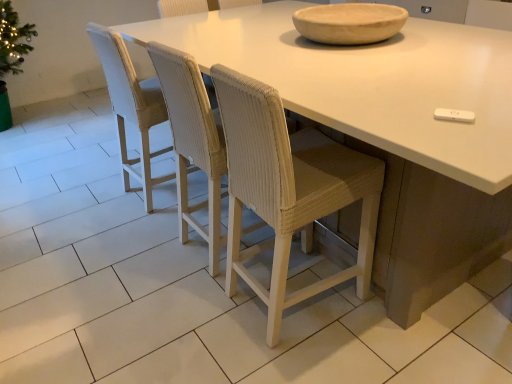
Question: Does woven white chair at left, which is the 1th chair in left-to-right order, appear on the right side of white woven chair at center, the fourth chair from the left?

Choices:
 (A) yes
 (B) no

Answer: (B)

Question: Considering the relative sizes of woven white chair at left, the fourth chair from the right, and white woven chair at center, which appears as the 1th chair when viewed from the right, in the image provided, is woven white chair at left, the fourth chair from the right, smaller than white woven chair at center, which appears as the 1th chair when viewed from the right,?

Choices:
 (A) no
 (B) yes

Answer: (A)

Question: From a real-world perspective, does woven white chair at left, the fourth chair from the right, sit lower than white woven chair at center, the fourth chair from the left?

Choices:
 (A) no
 (B) yes

Answer: (B)

Question: Is woven white chair at left, the fourth chair from the right, placed right next to white woven chair at center, which appears as the 1th chair when viewed from the right?

Choices:
 (A) no
 (B) yes

Answer: (A)

Question: Can you confirm if woven white chair at left, the fourth chair from the right, is positioned to the left of white woven chair at center, the fourth chair from the left?

Choices:
 (A) yes
 (B) no

Answer: (A)

Question: Is white matte table at center bigger or smaller than woven white chair at center, which ranks as the third chair in left-to-right order?

Choices:
 (A) big
 (B) small

Answer: (A)

Question: Looking at their shapes, would you say white matte table at center is wider or thinner than woven white chair at center, which ranks as the third chair in left-to-right order?

Choices:
 (A) wide
 (B) thin

Answer: (A)

Question: In the image, is white matte table at center positioned in front of or behind woven white chair at center, marked as the second chair in a right-to-left arrangement?

Choices:
 (A) front
 (B) behind

Answer: (A)

Question: Considering the relative positions of white matte table at center and woven white chair at center, which ranks as the third chair in left-to-right order, in the image provided, is white matte table at center to the left or to the right of woven white chair at center, which ranks as the third chair in left-to-right order,?

Choices:
 (A) right
 (B) left

Answer: (A)

Question: From the image's perspective, relative to woven white chair at center, the third chair from the right, is white matte table at center above or below?

Choices:
 (A) below
 (B) above

Answer: (B)

Question: Choose the correct answer: Is white matte table at center inside woven white chair at center, which is the 2th chair in left-to-right order, or outside it?

Choices:
 (A) inside
 (B) outside

Answer: (B)

Question: Considering the positions of white matte table at center and woven white chair at center, the third chair from the right, in the image, is white matte table at center bigger or smaller than woven white chair at center, the third chair from the right,?

Choices:
 (A) big
 (B) small

Answer: (A)

Question: In terms of height, does white matte table at center look taller or shorter compared to woven white chair at center, which is the 2th chair in left-to-right order?

Choices:
 (A) tall
 (B) short

Answer: (B)

Question: Relative to natural wood bowl at upper center, is white woven chair at center, the fourth chair from the left, in front or behind?

Choices:
 (A) behind
 (B) front

Answer: (A)

Question: From a real-world perspective, is white woven chair at center, which appears as the 1th chair when viewed from the right, physically located above or below natural wood bowl at upper center?

Choices:
 (A) below
 (B) above

Answer: (A)